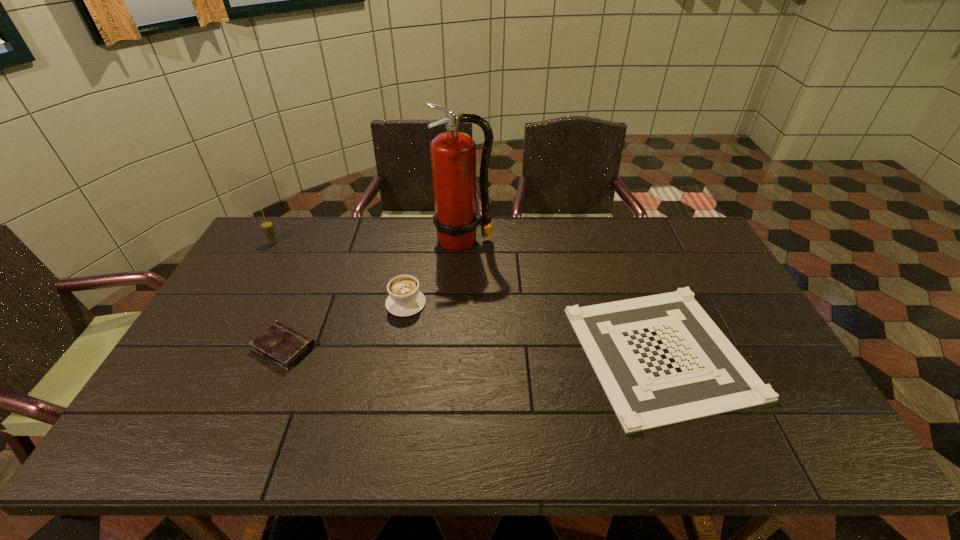
I want to click on free spot between the shortest object and the second object from left to right, so click(x=472, y=349).

The image size is (960, 540). What are the coordinates of `object that stands as the closest to the fourth object from left to right` in the screenshot? It's located at (405, 299).

Identify which object is located as the nearest to the third tallest object. Please provide its 2D coordinates. Your answer should be formatted as a tuple, i.e. [(x, y)], where the tuple contains the x and y coordinates of a point satisfying the conditions above.

[(453, 154)]

The image size is (960, 540). In order to click on free spot that satisfies the following two spatial constraints: 1. at the nozzle of the shortest object; 2. on the right side of the tallest object in this screenshot , I will do `click(459, 352)`.